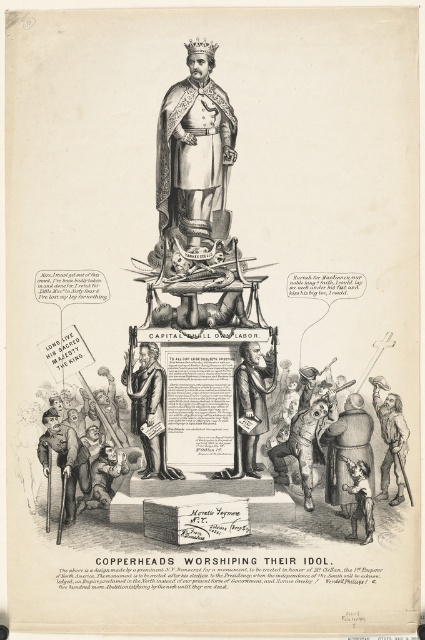
Question: Can you confirm if gold plated statue at center is positioned to the left of bronze statue at center?

Choices:
 (A) no
 (B) yes

Answer: (A)

Question: Which point is closer to the camera?

Choices:
 (A) gold textured crown at center
 (B) gold plated statue at center
 (C) matte black cane at lower left
 (D) bronze statue at center

Answer: (D)

Question: Which of the following is the farthest from the observer?

Choices:
 (A) (210, 51)
 (B) (152, 344)
 (C) (73, 497)
 (D) (207, 196)

Answer: (A)

Question: Which of the following is the farthest from the observer?

Choices:
 (A) bronze statue at center
 (B) gold plated statue at center

Answer: (B)

Question: Is bronze statue at center positioned before matte black cane at lower left?

Choices:
 (A) yes
 (B) no

Answer: (A)

Question: Considering the relative positions of gold plated statue at center and bronze statue at center in the image provided, where is gold plated statue at center located with respect to bronze statue at center?

Choices:
 (A) above
 (B) below

Answer: (A)